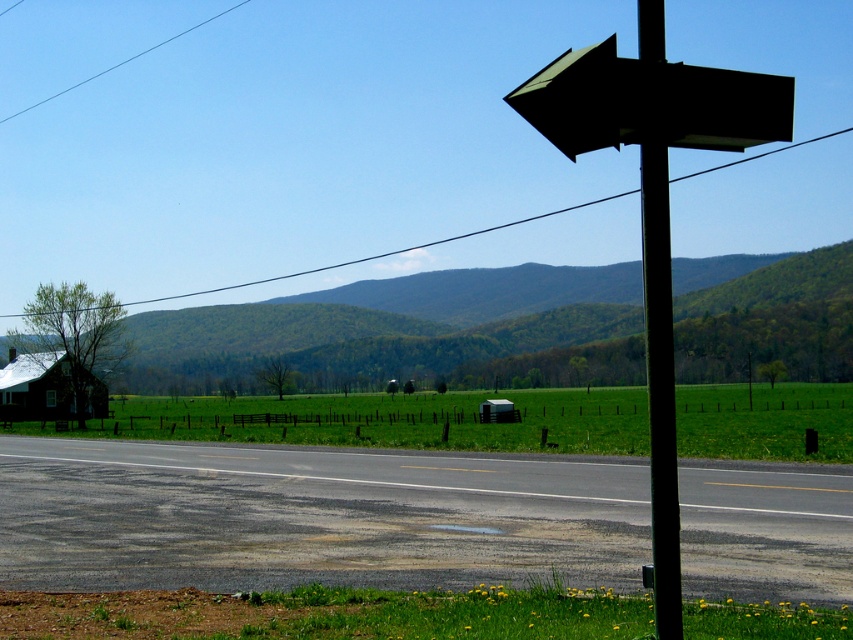
Does black matte arrow at upper right appear on the left side of green wire at upper center?

Incorrect, black matte arrow at upper right is not on the left side of green wire at upper center.

Who is positioned more to the right, black matte arrow at upper right or green wire at upper center?

black matte arrow at upper right

Image resolution: width=853 pixels, height=640 pixels. What do you see at coordinates (651, 104) in the screenshot? I see `black matte arrow at upper right` at bounding box center [651, 104].

Find the location of `black matte arrow at upper right`. black matte arrow at upper right is located at coordinates (651, 104).

Which is more to the left, green leafy mountain at center or green wire at upper center?

From the viewer's perspective, green wire at upper center appears more on the left side.

Which is behind, point (844, 260) or point (3, 316)?

The point (3, 316) is behind.

Identify the location of green leafy mountain at center. (376, 344).

Measure the distance between dark green matte arrow at upper right and clear blue wire at upper left.

dark green matte arrow at upper right and clear blue wire at upper left are 95.01 meters apart.

Which is more to the left, dark green matte arrow at upper right or clear blue wire at upper left?

clear blue wire at upper left is more to the left.

Find the location of a particular element. Image resolution: width=853 pixels, height=640 pixels. dark green matte arrow at upper right is located at coordinates (654, 202).